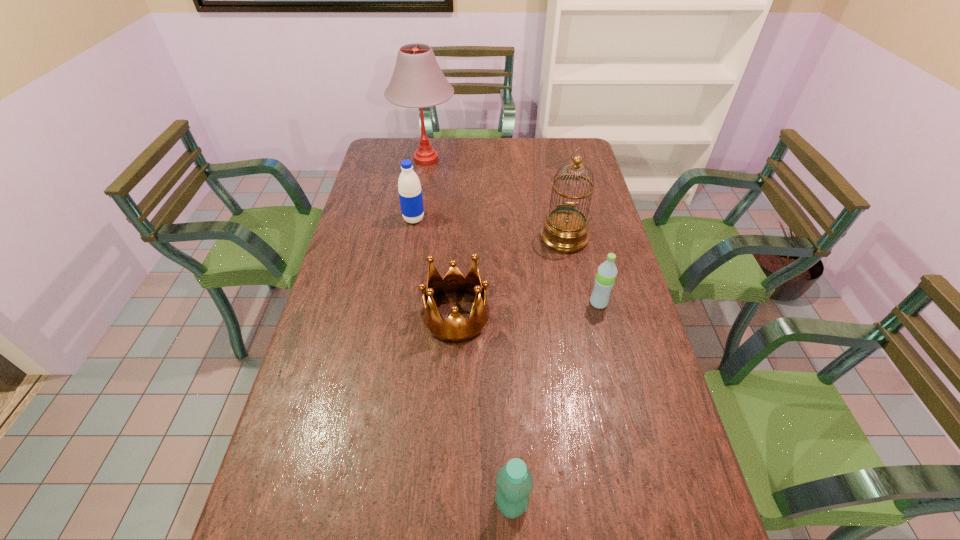
Identify which object is the closest to the leftmost water bottle. Please provide its 2D coordinates. Your answer should be formatted as a tuple, i.e. [(x, y)], where the tuple contains the x and y coordinates of a point satisfying the conditions above.

[(417, 82)]

Where is `object that is the closest to the birdcage`? This screenshot has width=960, height=540. object that is the closest to the birdcage is located at coordinates (607, 271).

Identify which water bottle is the third closest to the crown. Please provide its 2D coordinates. Your answer should be formatted as a tuple, i.e. [(x, y)], where the tuple contains the x and y coordinates of a point satisfying the conditions above.

[(515, 482)]

Locate an element on the screen. The height and width of the screenshot is (540, 960). water bottle that is the closest to the tallest object is located at coordinates (410, 193).

Find the location of a particular element. Image resolution: width=960 pixels, height=540 pixels. vacant space that satisfies the following two spatial constraints: 1. on the front-facing side of the crown; 2. on the right side of the table lamp is located at coordinates (401, 316).

Find the location of a particular element. Image resolution: width=960 pixels, height=540 pixels. vacant area in the image that satisfies the following two spatial constraints: 1. on the front side of the second farthest water bottle; 2. on the left side of the leftmost water bottle is located at coordinates (400, 303).

Identify the location of free space that satisfies the following two spatial constraints: 1. with an open door on the second tallest object; 2. on the right side of the second farthest water bottle. (577, 303).

Image resolution: width=960 pixels, height=540 pixels. In order to click on vacant space that satisfies the following two spatial constraints: 1. with an open door on the fifth shortest object; 2. on the right side of the rightmost water bottle in this screenshot , I will do `click(577, 303)`.

Locate an element on the screen. vacant space that satisfies the following two spatial constraints: 1. on the front-facing side of the table lamp; 2. on the back side of the rightmost water bottle is located at coordinates (403, 303).